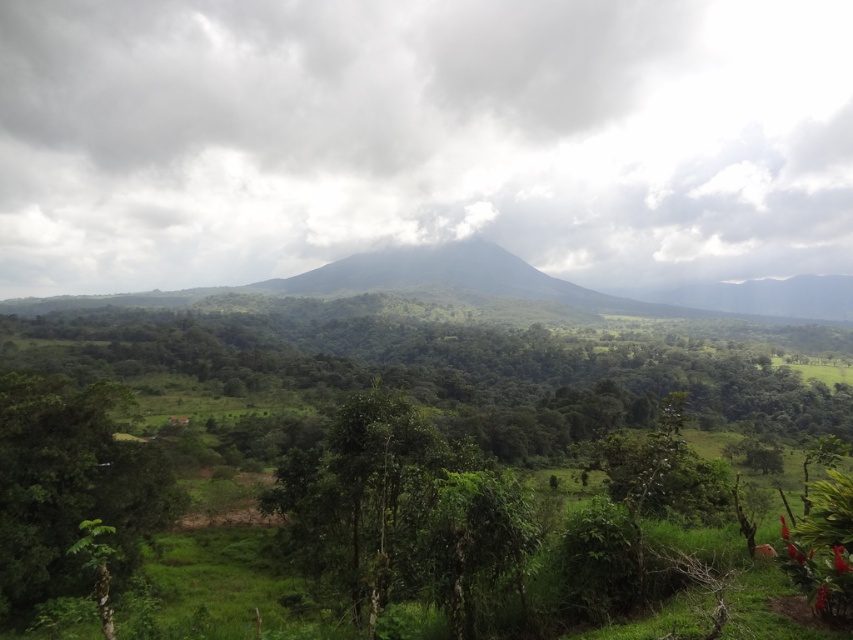
Does point (717, 424) come closer to viewer compared to point (91, 454)?

No, it is behind (91, 454).

Which is behind, point (741, 385) or point (1, 588)?

Point (741, 385)

This screenshot has height=640, width=853. Identify the location of green leafy tree at center. (431, 371).

Can you confirm if white fluffy cloud at upper center is positioned above green leafy tree at center?

Correct, white fluffy cloud at upper center is located above green leafy tree at center.

Between point (361, 93) and point (39, 346), which one is positioned behind?

Positioned behind is point (361, 93).

Describe the element at coordinates (421, 138) in the screenshot. I see `white fluffy cloud at upper center` at that location.

I want to click on white fluffy cloud at upper center, so click(421, 138).

Who is taller, white fluffy cloud at upper center or green leafy tree at lower left?

white fluffy cloud at upper center

Can you confirm if white fluffy cloud at upper center is positioned above green leafy tree at lower left?

Yes.

Describe the element at coordinates (421, 138) in the screenshot. I see `white fluffy cloud at upper center` at that location.

Identify the location of white fluffy cloud at upper center. (421, 138).